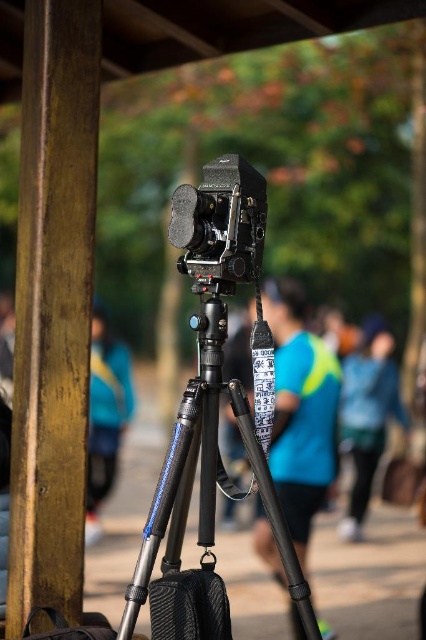
Question: Can you confirm if metallic tripod at center is bigger than blue fabric jacket at lower right?

Choices:
 (A) no
 (B) yes

Answer: (B)

Question: Among these points, which one is nearest to the camera?

Choices:
 (A) (92, 371)
 (B) (81, 22)
 (C) (287, 520)
 (D) (224, 170)

Answer: (D)

Question: Which point is closer to the camera taking this photo?

Choices:
 (A) (385, 413)
 (B) (255, 205)
 (C) (134, 588)
 (D) (94, 129)

Answer: (C)

Question: Observing the image, what is the correct spatial positioning of metallic tripod at center in reference to blue fabric jacket at lower right?

Choices:
 (A) below
 (B) above

Answer: (B)

Question: Which object is the closest to the blue fabric jacket at lower right?

Choices:
 (A) matte black camera at center
 (B) wooden pole at left
 (C) blue fabric shirt at center

Answer: (C)

Question: Does metallic tripod at center appear on the left side of matte black camera at center?

Choices:
 (A) no
 (B) yes

Answer: (B)